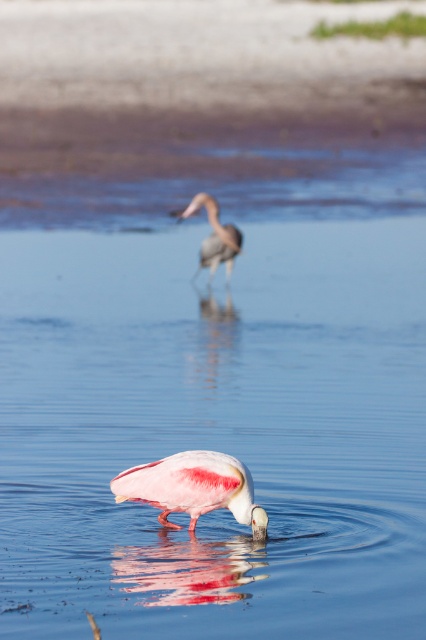
You are observing the scene and need to determine the position of the pink feathered spoonbill at lower center. What are its coordinates?

The pink feathered spoonbill at lower center is located at point [193,486].

You are a wildlife photographer aiming to capture a closeup shot of both the pink feathered spoonbill at lower center and the gray matte heron at center. Given their widths, which bird will require you to adjust your camera settings to account for its larger size?

The pink feathered spoonbill at lower center is wider than the gray matte heron at center, so you need to adjust your camera settings for the pink feathered spoonbill at lower center due to its larger width.